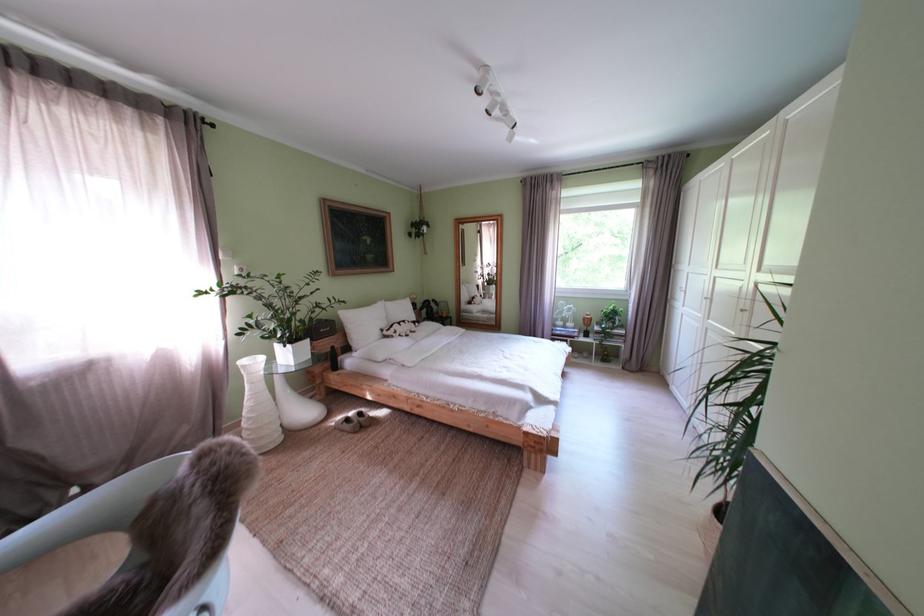
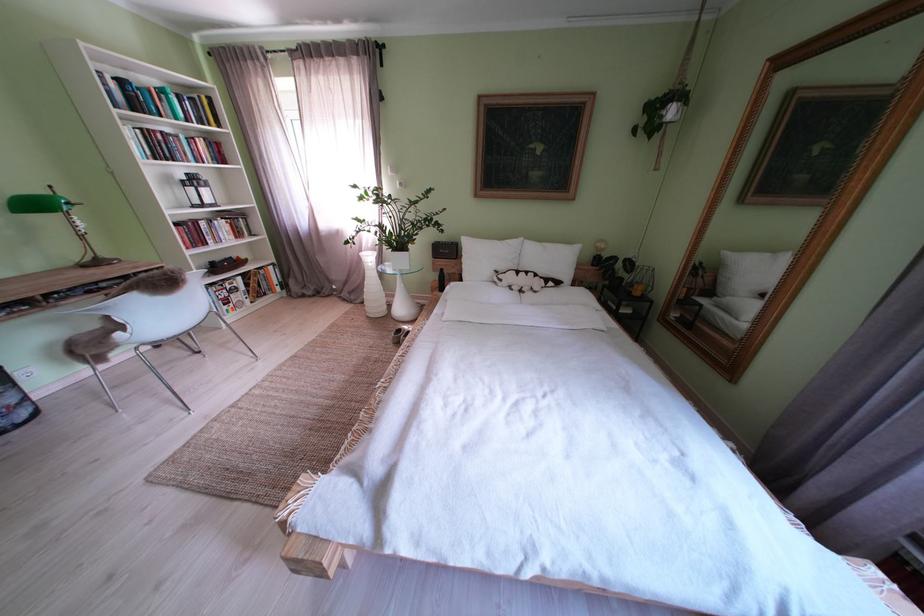
Find the pixel in the second image that matches [407,338] in the first image.

(512, 285)